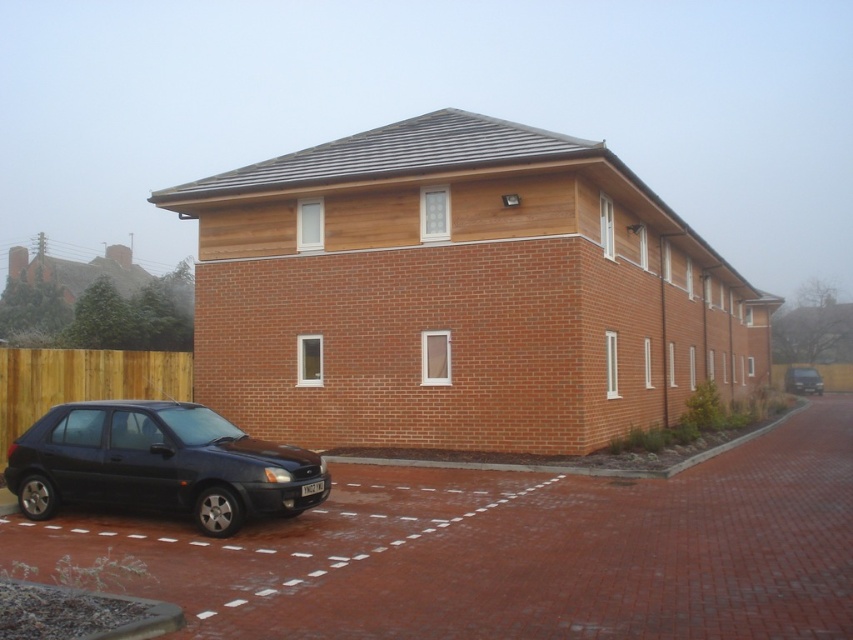
Does brick at lower left appear on the right side of matte black suv at right?

No, brick at lower left is not to the right of matte black suv at right.

Find the location of `brick at lower left`. brick at lower left is located at coordinates (518, 552).

Who is more distant from viewer, (335, 528) or (810, 390)?

Point (810, 390)

Where is `brick at lower left`? The height and width of the screenshot is (640, 853). brick at lower left is located at coordinates (518, 552).

Measure the distance between matte black car at lower left and camera.

They are 29.34 feet apart.

Looking at this image, does matte black car at lower left come in front of matte black suv at right?

Yes, it is in front of matte black suv at right.

Locate an element on the screen. The image size is (853, 640). matte black car at lower left is located at coordinates (160, 465).

Is point (316, 516) less distant than point (113, 458)?

No, it is behind (113, 458).

Between brick at lower left and matte black car at lower left, which one appears on the right side from the viewer's perspective?

Positioned to the right is brick at lower left.

Is point (532, 502) more distant than point (296, 483)?

Yes, it is behind point (296, 483).

The image size is (853, 640). I want to click on brick at lower left, so 518,552.